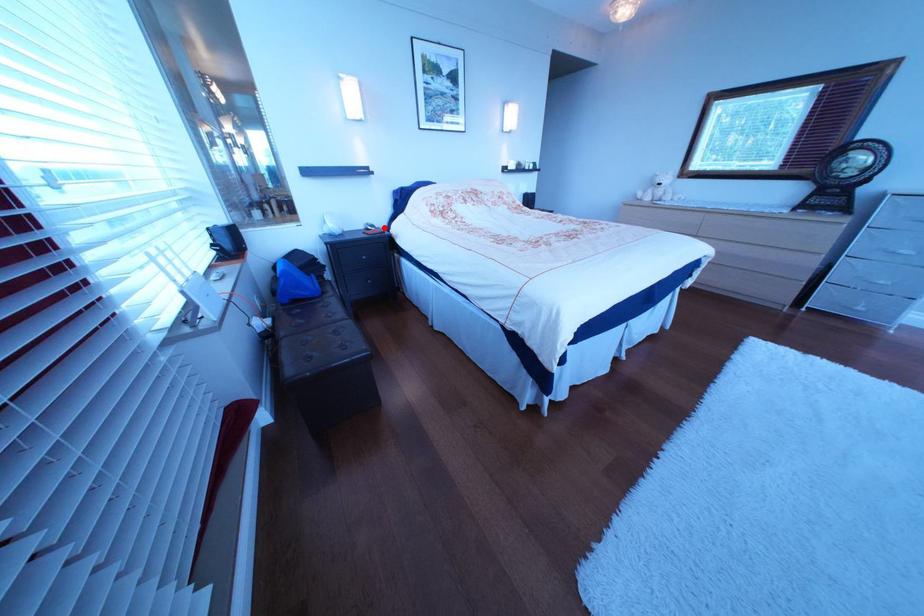
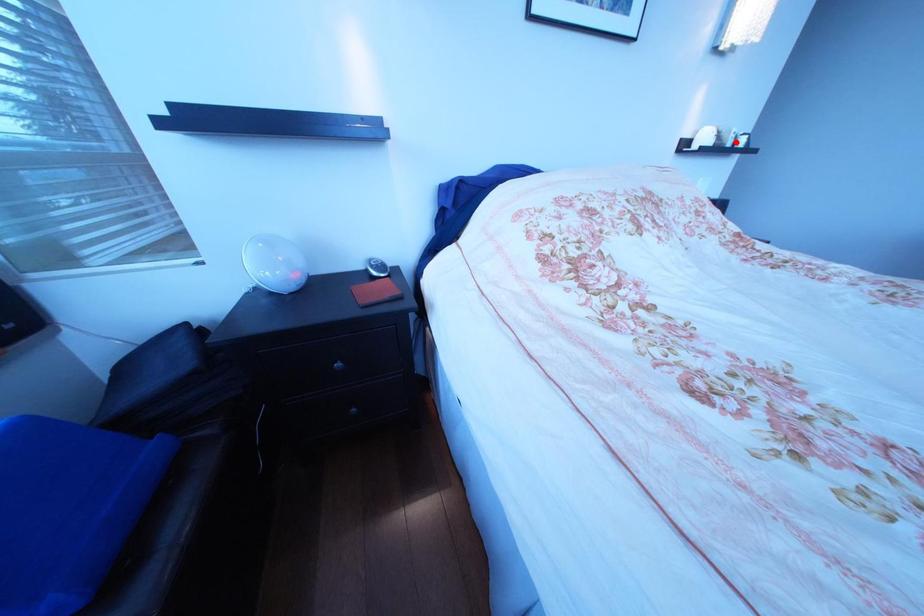
I am providing you with two images of the same scene from different viewpoints. A red point is marked on the first image and another point is marked on the second image. Does the point marked in image1 correspond to the same location as the one in image2?

No